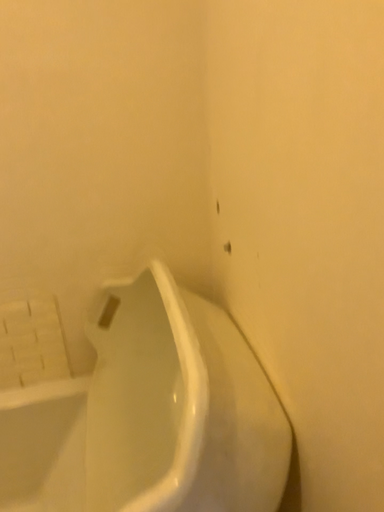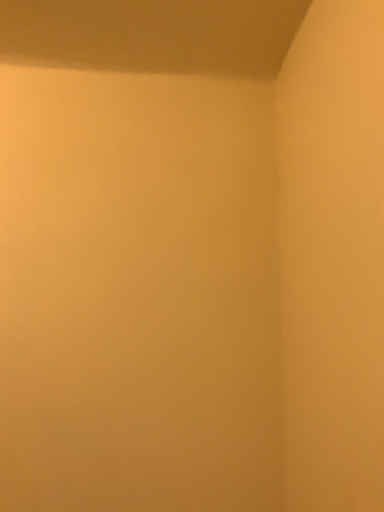
Question: How did the camera likely rotate when shooting the video?

Choices:
 (A) rotated downward
 (B) rotated upward

Answer: (B)